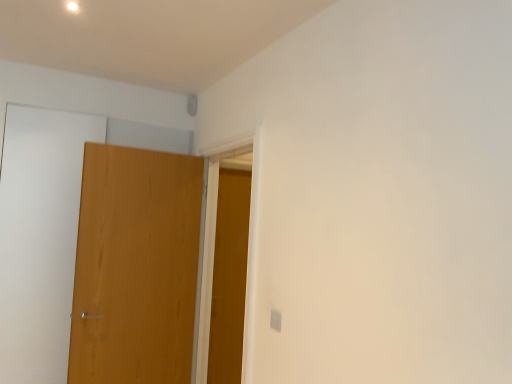
Question: From the image's perspective, is wooden door at left, positioned as the 1th door in front-to-back order, beneath wooden door at center, the second door from the left?

Choices:
 (A) no
 (B) yes

Answer: (A)

Question: Can you confirm if wooden door at left, marked as the 2th door in a back-to-front arrangement, is shorter than wooden door at center, the first door when ordered from right to left?

Choices:
 (A) no
 (B) yes

Answer: (B)

Question: Is wooden door at center, the second door from the left, at the back of wooden door at left, positioned as the first door in left-to-right order?

Choices:
 (A) no
 (B) yes

Answer: (A)

Question: Can you confirm if wooden door at left, positioned as the 1th door in front-to-back order, is positioned to the right of wooden door at center, the second door from the left?

Choices:
 (A) yes
 (B) no

Answer: (B)

Question: Can you confirm if wooden door at left, arranged as the second door when viewed from the right, is wider than wooden door at center, the first door when ordered from right to left?

Choices:
 (A) no
 (B) yes

Answer: (B)

Question: Is wooden door at left, marked as the 2th door in a back-to-front arrangement, further to the viewer compared to wooden door at center, arranged as the 1th door when viewed from the back?

Choices:
 (A) no
 (B) yes

Answer: (A)

Question: Can you confirm if wooden door at center, arranged as the 1th door when viewed from the back, is taller than wooden door at left, positioned as the first door in left-to-right order?

Choices:
 (A) no
 (B) yes

Answer: (B)

Question: From the image's perspective, does wooden door at center, marked as the second door in a front-to-back arrangement, appear lower than wooden door at left, positioned as the 1th door in front-to-back order?

Choices:
 (A) no
 (B) yes

Answer: (B)

Question: Is wooden door at center, marked as the second door in a front-to-back arrangement, not close to wooden door at left, marked as the 2th door in a back-to-front arrangement?

Choices:
 (A) yes
 (B) no

Answer: (B)

Question: Considering the relative sizes of wooden door at center, marked as the second door in a front-to-back arrangement, and wooden door at left, positioned as the 1th door in front-to-back order, in the image provided, is wooden door at center, marked as the second door in a front-to-back arrangement, shorter than wooden door at left, positioned as the 1th door in front-to-back order,?

Choices:
 (A) no
 (B) yes

Answer: (A)

Question: Is wooden door at center, the second door from the left, next to wooden door at left, marked as the 2th door in a back-to-front arrangement?

Choices:
 (A) no
 (B) yes

Answer: (A)

Question: Is wooden door at center, marked as the second door in a front-to-back arrangement, facing towards wooden door at left, marked as the 2th door in a back-to-front arrangement?

Choices:
 (A) yes
 (B) no

Answer: (B)

Question: Considering the positions of point (177, 319) and point (214, 380), is point (177, 319) closer or farther from the camera than point (214, 380)?

Choices:
 (A) farther
 (B) closer

Answer: (B)